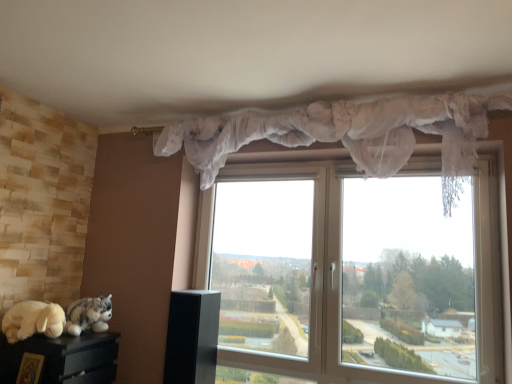
At what (x,y) coordinates should I click in order to perform the action: click on white lace curtain at upper center. Please return your answer as a coordinate pair (x, y). Looking at the image, I should click on (348, 134).

Measure the distance between point (474, 149) and camera.

Point (474, 149) is 1.98 meters from camera.

Where is `white plush toy at lower left`? white plush toy at lower left is located at coordinates (33, 320).

In the scene shown: Measure the distance from white plush toy at lower left to transparent plastic window at center.

A distance of 4.55 feet exists between white plush toy at lower left and transparent plastic window at center.

Locate an element on the screen. window on the right of white plush toy at lower left is located at coordinates (354, 272).

Which is farther from the camera, (50, 304) or (480, 203)?

The point (50, 304) is farther.

Which of these two, white plush toy at lower left or transparent plastic window at center, stands taller?

With more height is transparent plastic window at center.

Locate an element on the screen. cat that appears behind the wooden picture frame at lower left is located at coordinates (88, 315).

Is fluffy gray plush at lower left to the right of wooden picture frame at lower left from the viewer's perspective?

Indeed, fluffy gray plush at lower left is positioned on the right side of wooden picture frame at lower left.

How much distance is there between fluffy gray plush at lower left and wooden picture frame at lower left?

The distance of fluffy gray plush at lower left from wooden picture frame at lower left is 13.81 inches.

Looking at this image, is fluffy gray plush at lower left facing away from wooden picture frame at lower left?

fluffy gray plush at lower left does not have its back to wooden picture frame at lower left.

Is wooden picture frame at lower left positioned behind white plush toy at lower left?

No, wooden picture frame at lower left is closer to the viewer.

Who is bigger, wooden picture frame at lower left or white plush toy at lower left?

white plush toy at lower left is bigger.

Locate an element on the screen. The width and height of the screenshot is (512, 384). picture frame lying in front of the white plush toy at lower left is located at coordinates (30, 368).

Based on the photo, is white lace curtain at upper center facing towards transparent plastic window at center?

No.

How different are the orientations of white lace curtain at upper center and transparent plastic window at center in degrees?

The angle between the facing direction of white lace curtain at upper center and the facing direction of transparent plastic window at center is 1.01 degrees.

Between white lace curtain at upper center and transparent plastic window at center, which one has more height?

Standing taller between the two is transparent plastic window at center.

Is white lace curtain at upper center in contact with transparent plastic window at center?

No, white lace curtain at upper center is not with transparent plastic window at center.

In the scene shown: Which object is positioned more to the left, white lace curtain at upper center or fluffy gray plush at lower left?

Positioned to the left is fluffy gray plush at lower left.

In the scene shown: Are white lace curtain at upper center and fluffy gray plush at lower left located far from each other?

Indeed, white lace curtain at upper center is not near fluffy gray plush at lower left.

Is white lace curtain at upper center bigger or smaller than fluffy gray plush at lower left?

Clearly, white lace curtain at upper center is larger in size than fluffy gray plush at lower left.

At what (x,y) coordinates should I click in order to perform the action: click on curtain above the fluffy gray plush at lower left (from a real-world perspective). Please return your answer as a coordinate pair (x, y). Looking at the image, I should click on (348, 134).

This screenshot has height=384, width=512. I want to click on cat below the white plush toy at lower left (from the image's perspective), so click(88, 315).

Between fluffy gray plush at lower left and white plush toy at lower left, which one has more height?

With more height is fluffy gray plush at lower left.

How many degrees apart are the facing directions of fluffy gray plush at lower left and white plush toy at lower left?

fluffy gray plush at lower left and white plush toy at lower left are facing 5.96 degrees away from each other.

Is fluffy gray plush at lower left aimed at white plush toy at lower left?

No, fluffy gray plush at lower left does not turn towards white plush toy at lower left.

Considering the sizes of objects wooden picture frame at lower left and transparent plastic window at center in the image provided, who is thinner, wooden picture frame at lower left or transparent plastic window at center?

With smaller width is wooden picture frame at lower left.

Considering the points (41, 358) and (415, 310), which point is in front, point (41, 358) or point (415, 310)?

Positioned in front is point (41, 358).

From the image's perspective, which object appears higher, wooden picture frame at lower left or transparent plastic window at center?

transparent plastic window at center is shown above in the image.

Measure the distance from wooden picture frame at lower left to transparent plastic window at center.

The distance of wooden picture frame at lower left from transparent plastic window at center is 1.63 meters.

I want to click on animal that is below the transparent plastic window at center (from the image's perspective), so click(33, 320).

At what (x,y) coordinates should I click in order to perform the action: click on cat that is behind the wooden picture frame at lower left. Please return your answer as a coordinate pair (x, y). Looking at the image, I should click on tap(88, 315).

Estimate the real-world distances between objects in this image. Which object is closer to transparent plastic window at center, white plush toy at lower left or fluffy gray plush at lower left?

fluffy gray plush at lower left.

When comparing their distances from white plush toy at lower left, does white lace curtain at upper center or wooden picture frame at lower left seem further?

Among the two, white lace curtain at upper center is located further to white plush toy at lower left.

From the image, which object appears to be nearer to white plush toy at lower left, white lace curtain at upper center or transparent plastic window at center?

The object closer to white plush toy at lower left is transparent plastic window at center.

When comparing their distances from white plush toy at lower left, does transparent plastic window at center or fluffy gray plush at lower left seem further?

transparent plastic window at center.

When comparing their distances from fluffy gray plush at lower left, does transparent plastic window at center or white plush toy at lower left seem closer?

Among the two, white plush toy at lower left is located nearer to fluffy gray plush at lower left.

Looking at the image, which one is located closer to fluffy gray plush at lower left, wooden picture frame at lower left or white plush toy at lower left?

white plush toy at lower left.

Based on their spatial positions, is white plush toy at lower left or transparent plastic window at center further from white lace curtain at upper center?

Among the two, white plush toy at lower left is located further to white lace curtain at upper center.

Considering their positions, is wooden picture frame at lower left positioned further to transparent plastic window at center than fluffy gray plush at lower left?

wooden picture frame at lower left is positioned further to the anchor transparent plastic window at center.

Where is `curtain between white plush toy at lower left and transparent plastic window at center from left to right`? curtain between white plush toy at lower left and transparent plastic window at center from left to right is located at coordinates (348, 134).

Locate an element on the screen. This screenshot has width=512, height=384. cat between wooden picture frame at lower left and white lace curtain at upper center in the horizontal direction is located at coordinates (88, 315).

The image size is (512, 384). In order to click on cat between white plush toy at lower left and transparent plastic window at center from left to right in this screenshot , I will do `click(88, 315)`.

This screenshot has height=384, width=512. What are the coordinates of `curtain between fluffy gray plush at lower left and transparent plastic window at center in the horizontal direction` in the screenshot? It's located at (348, 134).